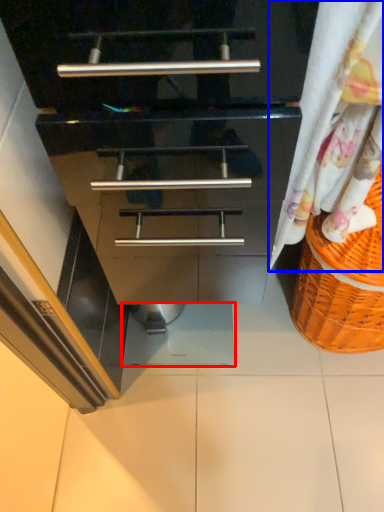
Question: Which object appears farthest to the camera in this image, tile (highlighted by a red box) or curtain (highlighted by a blue box)?

Choices:
 (A) tile
 (B) curtain

Answer: (A)